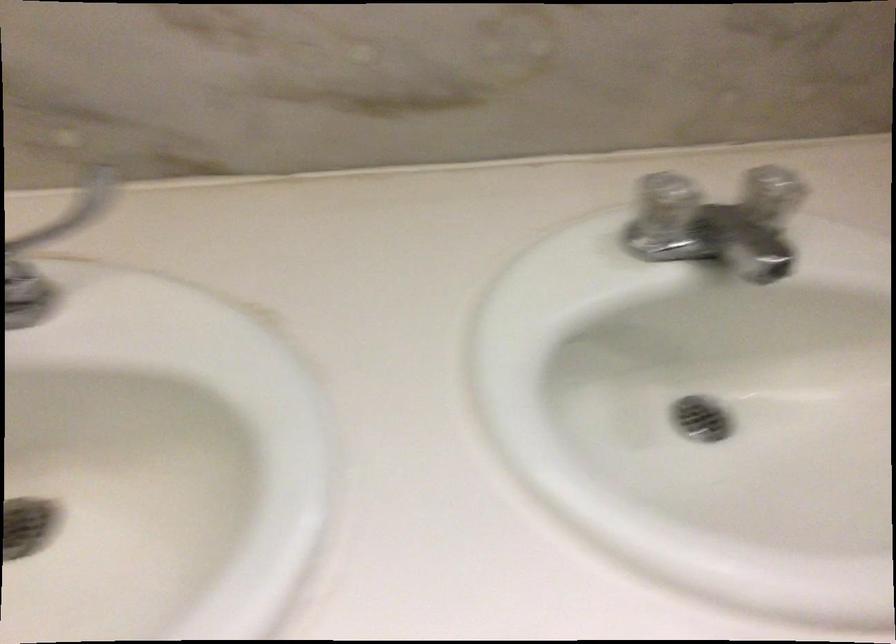
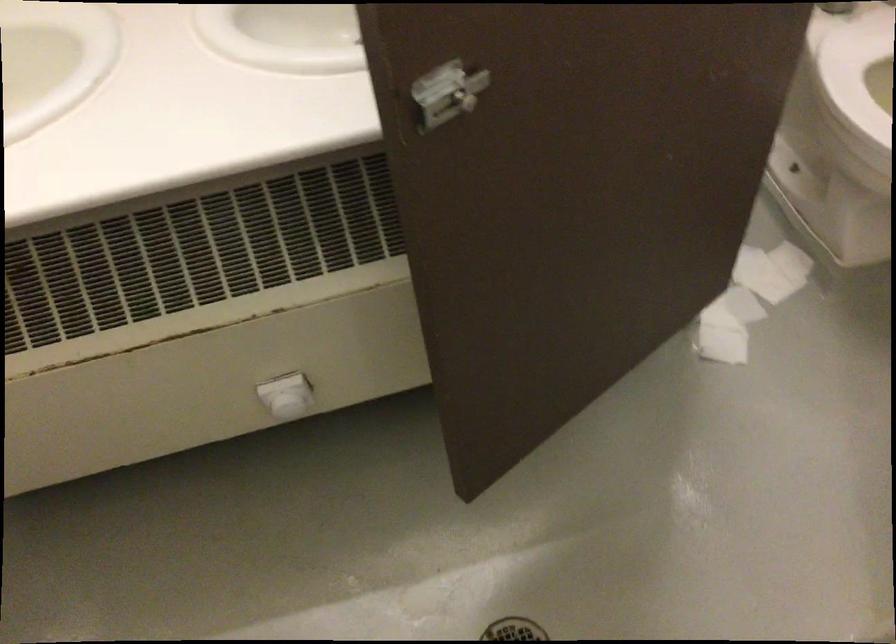
Question: How did the camera likely rotate?

Choices:
 (A) Left
 (B) Right
 (C) Up
 (D) Down

Answer: (A)